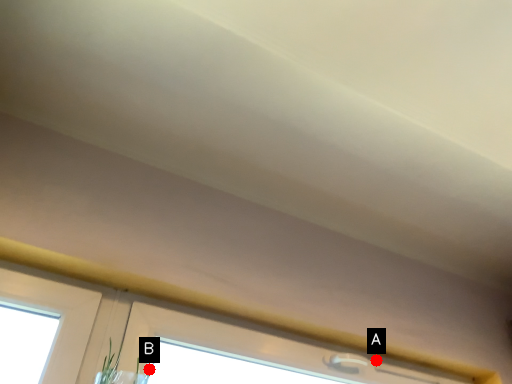
Question: Two points are circled on the image, labeled by A and B beside each circle. Which of the following is the closest to the observer?

Choices:
 (A) A is closer
 (B) B is closer

Answer: (B)